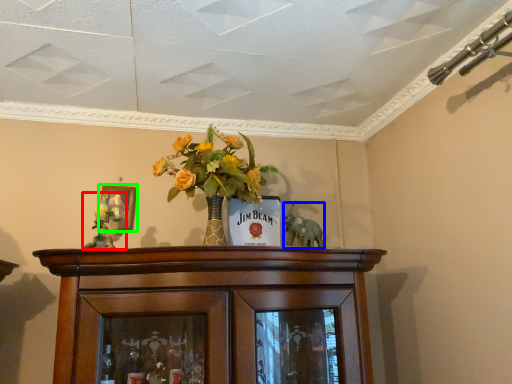
Question: Based on their relative distances, which object is nearer to floral arrangement (highlighted by a red box)? Choose from animal (highlighted by a blue box) and picture frame (highlighted by a green box).

Choices:
 (A) animal
 (B) picture frame

Answer: (B)